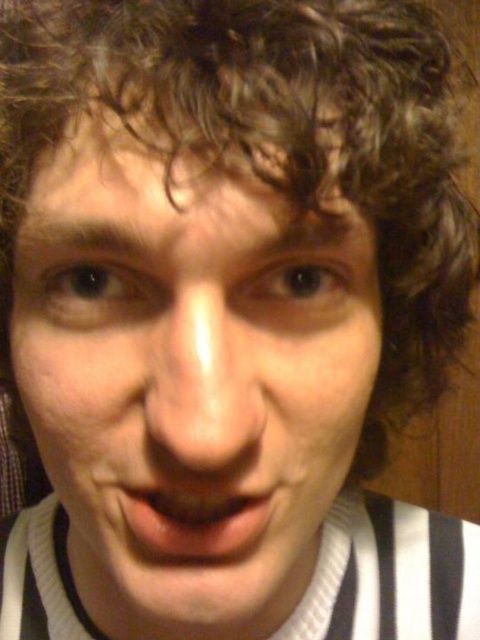
Question: In this image, where is smooth skin face at center located relative to smooth skin nose at center?

Choices:
 (A) above
 (B) below

Answer: (B)

Question: Estimate the real-world distances between objects in this image. Which object is farther from the smooth skin nose at center?

Choices:
 (A) smooth skin face at center
 (B) glossy pink lips at center

Answer: (A)

Question: Does smooth skin face at center come in front of glossy pink lips at center?

Choices:
 (A) yes
 (B) no

Answer: (A)

Question: Which of the following is the closest to the observer?

Choices:
 (A) smooth skin face at center
 (B) glossy pink lips at center
 (C) smooth skin nose at center

Answer: (A)

Question: Which object is positioned closest to the smooth skin nose at center?

Choices:
 (A) smooth skin face at center
 (B) glossy pink lips at center

Answer: (B)

Question: Does smooth skin nose at center appear on the right side of glossy pink lips at center?

Choices:
 (A) no
 (B) yes

Answer: (B)